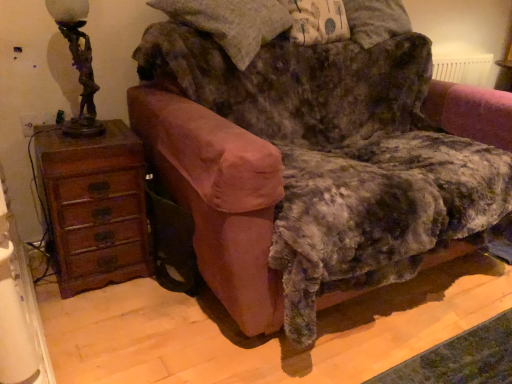
Question: From a real-world perspective, is bronze statue-like at left physically above brown wooden chest of drawers at left?

Choices:
 (A) no
 (B) yes

Answer: (B)

Question: Is bronze statue-like at left shorter than brown wooden chest of drawers at left?

Choices:
 (A) yes
 (B) no

Answer: (A)

Question: Is bronze statue-like at left to the left of brown wooden chest of drawers at left from the viewer's perspective?

Choices:
 (A) no
 (B) yes

Answer: (A)

Question: Is bronze statue-like at left further to the viewer compared to brown wooden chest of drawers at left?

Choices:
 (A) yes
 (B) no

Answer: (B)

Question: Is bronze statue-like at left smaller than brown wooden chest of drawers at left?

Choices:
 (A) no
 (B) yes

Answer: (B)

Question: Would you say bronze statue-like at left contains brown wooden chest of drawers at left?

Choices:
 (A) no
 (B) yes

Answer: (A)

Question: Considering the relative sizes of brown wooden chest of drawers at left and bronze statue-like at left in the image provided, is brown wooden chest of drawers at left smaller than bronze statue-like at left?

Choices:
 (A) yes
 (B) no

Answer: (B)

Question: From a real-world perspective, is brown wooden chest of drawers at left physically below bronze statue-like at left?

Choices:
 (A) yes
 (B) no

Answer: (A)

Question: Does brown wooden chest of drawers at left have a greater width compared to bronze statue-like at left?

Choices:
 (A) no
 (B) yes

Answer: (B)

Question: Is brown wooden chest of drawers at left in front of bronze statue-like at left?

Choices:
 (A) no
 (B) yes

Answer: (A)

Question: Are brown wooden chest of drawers at left and bronze statue-like at left beside each other?

Choices:
 (A) yes
 (B) no

Answer: (B)

Question: Can you confirm if brown wooden chest of drawers at left is bigger than bronze statue-like at left?

Choices:
 (A) yes
 (B) no

Answer: (A)

Question: Does velvet pink armchair at center have a greater width compared to brown wooden chest of drawers at left?

Choices:
 (A) no
 (B) yes

Answer: (B)